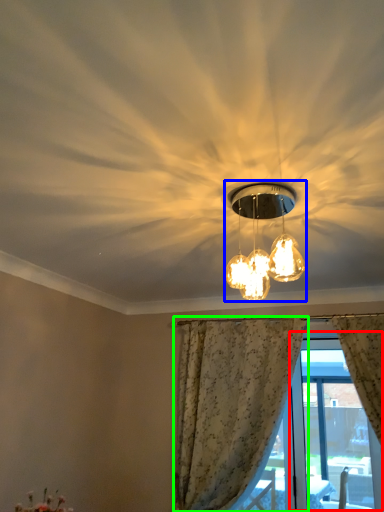
Question: Considering the real-world distances, which object is farthest from window screen (highlighted by a red box)? lamp (highlighted by a blue box) or curtain (highlighted by a green box)?

Choices:
 (A) lamp
 (B) curtain

Answer: (A)